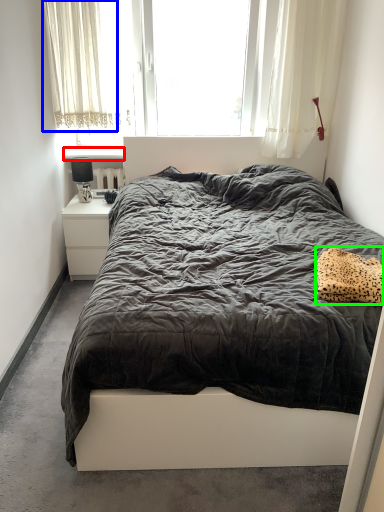
Question: Which object is the closest to the window sill (highlighted by a red box)? Choose among these: curtain (highlighted by a blue box) or pillow (highlighted by a green box).

Choices:
 (A) curtain
 (B) pillow

Answer: (A)